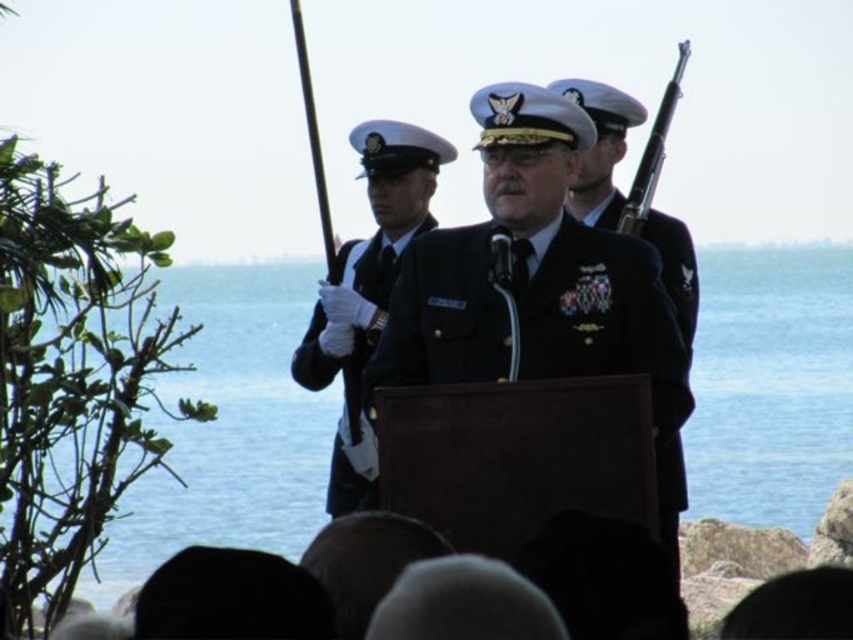
Question: Does blue water at center appear on the right side of black glossy uniform at center?

Choices:
 (A) no
 (B) yes

Answer: (B)

Question: Which point is closer to the camera?

Choices:
 (A) black polished rifle at upper right
 (B) black matte uniform at center
 (C) blue water at center

Answer: (B)

Question: Which of the following is the farthest from the observer?

Choices:
 (A) (650, 164)
 (B) (310, 358)
 (C) (444, 353)
 (D) (840, 291)

Answer: (D)

Question: Which of the following is the closest to the observer?

Choices:
 (A) (368, 490)
 (B) (670, 84)
 (C) (280, 356)

Answer: (A)

Question: Is the position of blue water at center less distant than that of black matte uniform at center?

Choices:
 (A) no
 (B) yes

Answer: (A)

Question: Does blue water at center have a larger size compared to black matte uniform at center?

Choices:
 (A) yes
 (B) no

Answer: (A)